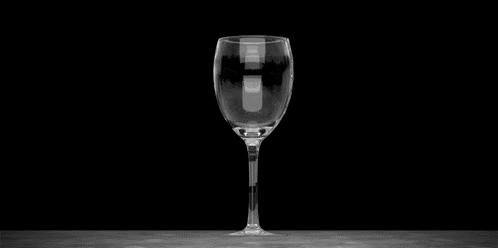
Where is `table`? This screenshot has width=498, height=248. table is located at coordinates (178, 236).